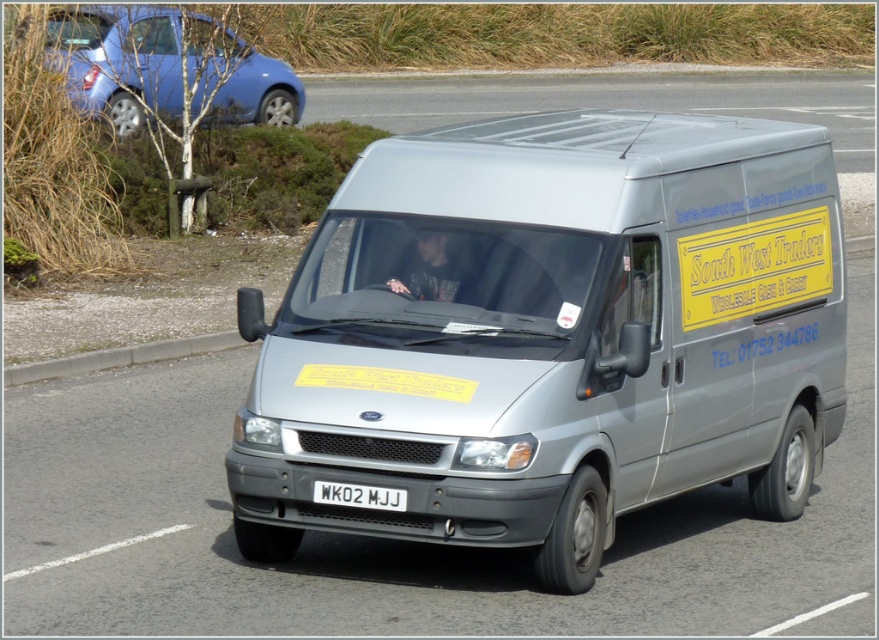
You are a delivery driver who needs to attach a new yellow paper advertisement to your van. The current yellow paper at center is already placed 8.57 feet away from the white plastic license plate at center. If the regulations require that the new advertisement must be placed within 5 feet of the license plate, can you place the new advertisement closer to the license plate without overlapping the existing one?

The current yellow paper at center is 8.57 feet away from the white plastic license plate at center. Since the regulation requires the new advertisement to be within 5 feet of the license plate, you can place the new advertisement closer to the license plate, but ensure it does not overlap with the existing yellow paper at center.

You are a delivery driver who needs to attach a GPS device to the silver metallic van at center. The GPS device must be placed exactly 5 feet away from the white plastic license plate at center. Based on the van layout, is this possible?

The silver metallic van at center and white plastic license plate at center are 4.86 feet apart. Since the GPS device needs to be placed exactly 5 feet away from the license plate, it would be slightly beyond the van, so attaching it directly to the van might not be feasible.

You are a pedestrian standing on the sidewalk and see the silver metallic van at center and the yellow paper at center. Which object is bigger?

The silver metallic van at center is larger in size than yellow paper at center.